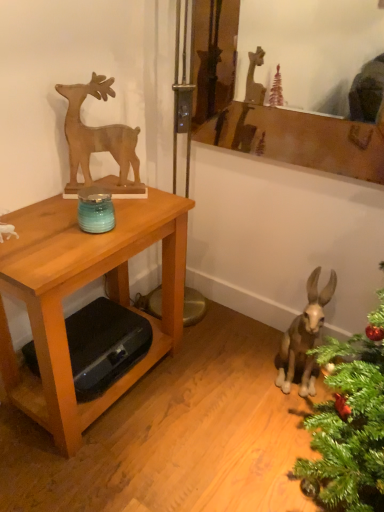
Question: From the image's perspective, would you say wooden deer at upper left is shown under wooden table at left?

Choices:
 (A) no
 (B) yes

Answer: (A)

Question: Is wooden deer at upper left taller than wooden table at left?

Choices:
 (A) yes
 (B) no

Answer: (B)

Question: Can you confirm if wooden deer at upper left is positioned to the left of wooden table at left?

Choices:
 (A) yes
 (B) no

Answer: (B)

Question: Does wooden deer at upper left appear on the right side of wooden table at left?

Choices:
 (A) yes
 (B) no

Answer: (A)

Question: Is the position of wooden deer at upper left less distant than that of wooden table at left?

Choices:
 (A) no
 (B) yes

Answer: (A)

Question: From the image's perspective, would you say wooden deer at upper left is positioned over wooden table at left?

Choices:
 (A) no
 (B) yes

Answer: (B)

Question: From a real-world perspective, is wooden mirror at upper center physically above brown matte donkey at lower right?

Choices:
 (A) yes
 (B) no

Answer: (A)

Question: Is there a large distance between wooden mirror at upper center and brown matte donkey at lower right?

Choices:
 (A) yes
 (B) no

Answer: (A)

Question: Does wooden mirror at upper center lie in front of brown matte donkey at lower right?

Choices:
 (A) no
 (B) yes

Answer: (B)

Question: Is brown matte donkey at lower right at the back of wooden mirror at upper center?

Choices:
 (A) no
 (B) yes

Answer: (A)

Question: Is wooden mirror at upper center outside brown matte donkey at lower right?

Choices:
 (A) yes
 (B) no

Answer: (A)

Question: Are wooden mirror at upper center and brown matte donkey at lower right beside each other?

Choices:
 (A) no
 (B) yes

Answer: (A)

Question: Is wooden table at left inside wooden mirror at upper center?

Choices:
 (A) no
 (B) yes

Answer: (A)